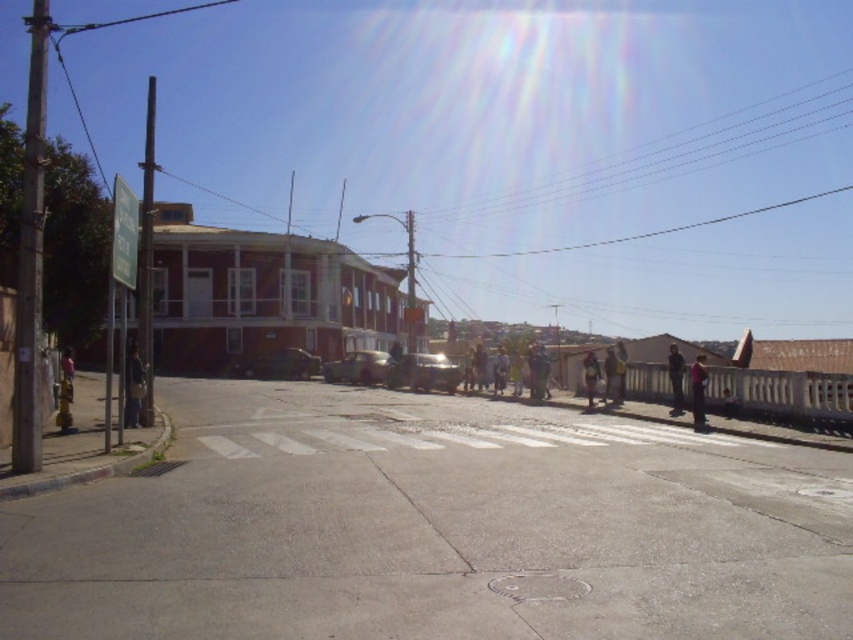
You are a pedestrian standing on the road and see the metallic silver train at center and the light brown leather jacket at upper right. Which object is positioned higher in the image?

The light brown leather jacket at upper right is positioned higher than the metallic silver train at center.

You are a delivery person who needs to place two packages on the sidewalk. You have a light brown leather jacket at upper right and a light brown leather jacket at center. Which jacket is positioned more to the east?

The light brown leather jacket at upper right is positioned more to the east because it is to the right of the light brown leather jacket at center, and in the scene, east is to the right side.